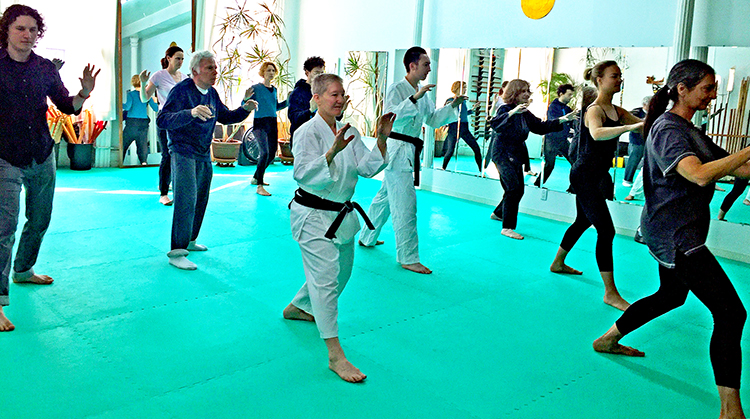
This screenshot has width=750, height=419. Identify the location of potted plant. (229, 149), (283, 148).